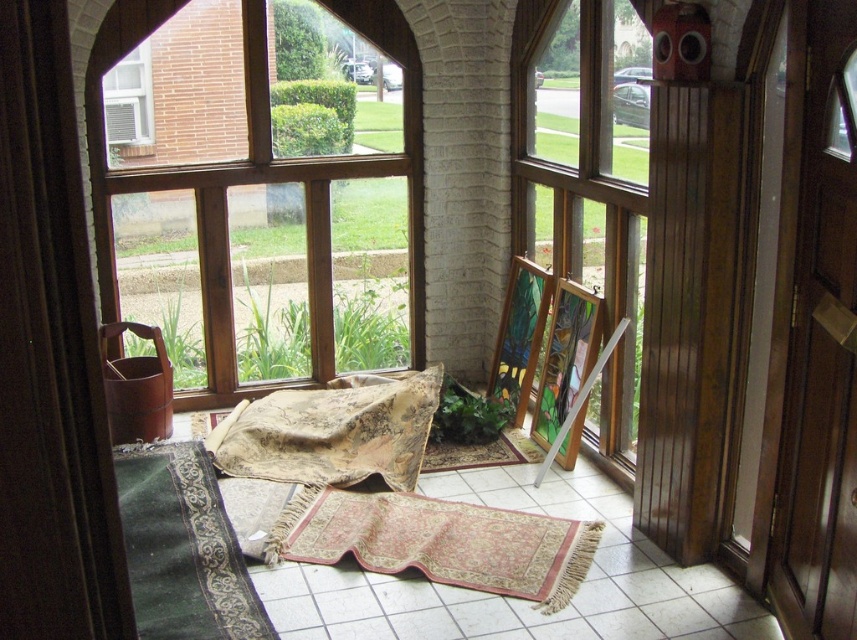
Which is in front, point (418, 422) or point (132, 74)?

Point (418, 422)

Is woven fabric at center to the right of white plastic air conditioner at upper left from the viewer's perspective?

Correct, you'll find woven fabric at center to the right of white plastic air conditioner at upper left.

This screenshot has width=857, height=640. What do you see at coordinates (334, 433) in the screenshot? I see `woven fabric at center` at bounding box center [334, 433].

Locate an element on the screen. This screenshot has width=857, height=640. woven fabric at center is located at coordinates pos(334,433).

Is dark green textured rug at lower left positioned behind rug with intricate patterns at center?

No, it is in front of rug with intricate patterns at center.

Is dark green textured rug at lower left smaller than rug with intricate patterns at center?

Actually, dark green textured rug at lower left might be larger than rug with intricate patterns at center.

Find the location of a particular element. dark green textured rug at lower left is located at coordinates (183, 547).

Between point (405, 164) and point (834, 42), which one is positioned behind?

Positioned behind is point (405, 164).

Can you confirm if wooden frame at left is shorter than brown wooden screen door at right?

In fact, wooden frame at left may be taller than brown wooden screen door at right.

Between point (333, 324) and point (811, 44), which one is positioned behind?

The point (333, 324) is behind.

Where is `wooden frame at left`? Image resolution: width=857 pixels, height=640 pixels. wooden frame at left is located at coordinates pos(261,156).